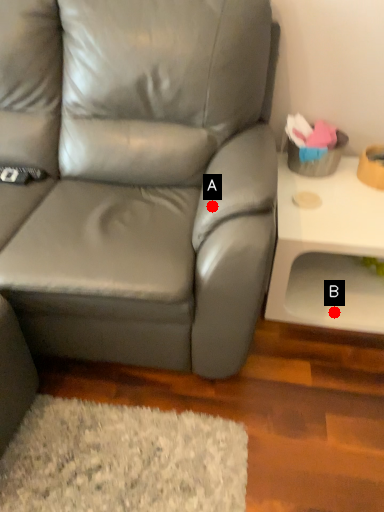
Question: Two points are circled on the image, labeled by A and B beside each circle. Which point appears closest to the camera in this image?

Choices:
 (A) A is closer
 (B) B is closer

Answer: (A)